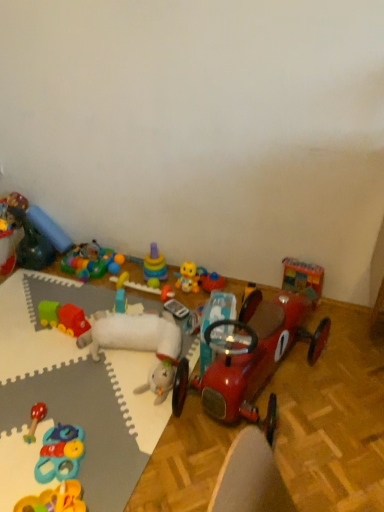
Find the location of `vacant space that's between wooden rattle at lower left, the seventh toy viewed from the right, and white plush lamb at lower left, the fifth toy positioned from the right`. vacant space that's between wooden rattle at lower left, the seventh toy viewed from the right, and white plush lamb at lower left, the fifth toy positioned from the right is located at coordinates (88, 395).